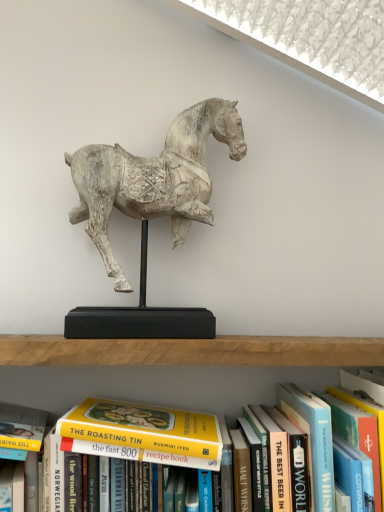
In order to face yellow paperback book at center, should I rotate leftwards or rightwards?

A 6.411 degree turn to the left will do.

Measure the distance between point (178, 144) and camera.

The distance of point (178, 144) from camera is 30.59 inches.

Identify the location of hardcover book at center, acting as the 2th paperback book starting from the right. The width and height of the screenshot is (384, 512). (313, 441).

Looking at this image, in terms of height, does hardcover book at center, which is counted as the first paperback book, starting from the left, look taller or shorter compared to yellow paperback book at center?

hardcover book at center, which is counted as the first paperback book, starting from the left, is taller than yellow paperback book at center.

Does point (334, 510) come behind point (211, 436)?

No.

Is hardcover book at center, which is counted as the first paperback book, starting from the left, next to yellow paperback book at center and touching it?

They are not placed beside each other.

Which of these two, hardcover book at center, which is counted as the first paperback book, starting from the left, or yellow paperback book at center, is thinner?

Thinner between the two is yellow paperback book at center.

From the image's perspective, which one is positioned lower, white wood horse at center or hardcover book at center, acting as the 2th paperback book starting from the right?

hardcover book at center, acting as the 2th paperback book starting from the right, from the image's perspective.

From the picture: Visually, is white wood horse at center positioned to the left or to the right of hardcover book at center, which is counted as the first paperback book, starting from the left?

white wood horse at center is to the left of hardcover book at center, which is counted as the first paperback book, starting from the left.

The height and width of the screenshot is (512, 384). Identify the location of horse that is above the hardcover book at center, which is counted as the first paperback book, starting from the left (from the image's perspective). (154, 178).

Is white wood horse at center bigger than hardcover book at center, which is counted as the first paperback book, starting from the left?

Yes.

Image resolution: width=384 pixels, height=512 pixels. I want to click on book on the left of hardcover book at center, the 1th paperback book viewed from the right, so click(x=142, y=434).

Which is in front, point (375, 455) or point (206, 431)?

Point (375, 455)

Is hardcover book at center, arranged as the 2th paperback book when viewed from the left, positioned beyond the bounds of yellow paperback book at center?

Yes, hardcover book at center, arranged as the 2th paperback book when viewed from the left, is not within yellow paperback book at center.

Is hardcover book at center, the 1th paperback book viewed from the right, touching yellow paperback book at center?

hardcover book at center, the 1th paperback book viewed from the right, and yellow paperback book at center are not in contact.

Is there a large distance between yellow paperback book at center and hardcover book at center, which is counted as the first paperback book, starting from the left?

They are positioned close to each other.

How many degrees apart are the facing directions of yellow paperback book at center and hardcover book at center, acting as the 2th paperback book starting from the right?

0.000523 degrees.

Considering the positions of point (203, 450) and point (292, 384), is point (203, 450) closer or farther from the camera than point (292, 384)?

Point (203, 450).

Where is `book located above the hardcover book at center, which is counted as the first paperback book, starting from the left (from a real-world perspective)`? book located above the hardcover book at center, which is counted as the first paperback book, starting from the left (from a real-world perspective) is located at coordinates (142, 434).

Looking at this image, could you tell me if hardcover book at center, acting as the 2th paperback book starting from the right, is turned towards white wood horse at center?

No.

How many degrees apart are the facing directions of hardcover book at center, acting as the 2th paperback book starting from the right, and white wood horse at center?

hardcover book at center, acting as the 2th paperback book starting from the right, and white wood horse at center are facing 4.95 degrees away from each other.

From a real-world perspective, is hardcover book at center, acting as the 2th paperback book starting from the right, over white wood horse at center?

Actually, hardcover book at center, acting as the 2th paperback book starting from the right, is physically below white wood horse at center in the real world.

Considering the relative sizes of hardcover book at center, acting as the 2th paperback book starting from the right, and white wood horse at center in the image provided, is hardcover book at center, acting as the 2th paperback book starting from the right, wider than white wood horse at center?

Indeed, hardcover book at center, acting as the 2th paperback book starting from the right, has a greater width compared to white wood horse at center.

Is hardcover book at center, arranged as the 2th paperback book when viewed from the left, oriented away from white wood horse at center?

No, hardcover book at center, arranged as the 2th paperback book when viewed from the left, is not facing away from white wood horse at center.

From a real-world perspective, is hardcover book at center, arranged as the 2th paperback book when viewed from the left, below white wood horse at center?

Yes, from a real-world perspective, hardcover book at center, arranged as the 2th paperback book when viewed from the left, is under white wood horse at center.

Between hardcover book at center, arranged as the 2th paperback book when viewed from the left, and white wood horse at center, which one has more height?

Standing taller between the two is white wood horse at center.

Considering the sizes of objects hardcover book at center, arranged as the 2th paperback book when viewed from the left, and white wood horse at center in the image provided, who is thinner, hardcover book at center, arranged as the 2th paperback book when viewed from the left, or white wood horse at center?

white wood horse at center is thinner.

From a real-world perspective, is white wood horse at center below yellow paperback book at center?

No, from a real-world perspective, white wood horse at center is not below yellow paperback book at center.

Considering their positions, is white wood horse at center located in front of or behind yellow paperback book at center?

white wood horse at center is behind yellow paperback book at center.

What's the angular difference between white wood horse at center and yellow paperback book at center's facing directions?

white wood horse at center and yellow paperback book at center are facing 4.95 degrees away from each other.

Is point (173, 142) in front of point (69, 426)?

No, (173, 142) is further to viewer.

Locate an element on the screen. the 1st paperback book located beneath the yellow paperback book at center (from a real-world perspective) is located at coordinates (313, 441).

In the image, there is a hardcover book at center, acting as the 2th paperback book starting from the right. Find the location of `horse above it (from the image's perspective)`. horse above it (from the image's perspective) is located at coordinates (154, 178).

Considering their positions, is white wood horse at center positioned closer to hardcover book at center, which is counted as the first paperback book, starting from the left, than hardcover book at center, the 1th paperback book viewed from the right?

Based on the image, hardcover book at center, the 1th paperback book viewed from the right, appears to be nearer to hardcover book at center, which is counted as the first paperback book, starting from the left.

Consider the image. From the image, which object appears to be nearer to hardcover book at center, acting as the 2th paperback book starting from the right, hardcover book at center, arranged as the 2th paperback book when viewed from the left, or white wood horse at center?

Based on the image, hardcover book at center, arranged as the 2th paperback book when viewed from the left, appears to be nearer to hardcover book at center, acting as the 2th paperback book starting from the right.

When comparing their distances from hardcover book at center, arranged as the 2th paperback book when viewed from the left, does hardcover book at center, which is counted as the first paperback book, starting from the left, or white wood horse at center seem closer?

Among the two, hardcover book at center, which is counted as the first paperback book, starting from the left, is located nearer to hardcover book at center, arranged as the 2th paperback book when viewed from the left.

Based on their spatial positions, is hardcover book at center, acting as the 2th paperback book starting from the right, or yellow paperback book at center further from hardcover book at center, arranged as the 2th paperback book when viewed from the left?

yellow paperback book at center is further to hardcover book at center, arranged as the 2th paperback book when viewed from the left.

Which object lies nearer to the anchor point yellow paperback book at center, white wood horse at center or hardcover book at center, arranged as the 2th paperback book when viewed from the left?

hardcover book at center, arranged as the 2th paperback book when viewed from the left, is closer to yellow paperback book at center.

Looking at this image, looking at the image, which one is located closer to yellow paperback book at center, hardcover book at center, the 1th paperback book viewed from the right, or white wood horse at center?

Among the two, hardcover book at center, the 1th paperback book viewed from the right, is located nearer to yellow paperback book at center.

Which object lies further to the anchor point white wood horse at center, hardcover book at center, the 1th paperback book viewed from the right, or yellow paperback book at center?

Among the two, hardcover book at center, the 1th paperback book viewed from the right, is located further to white wood horse at center.

Looking at the image, which one is located closer to hardcover book at center, the 1th paperback book viewed from the right, yellow paperback book at center or hardcover book at center, which is counted as the first paperback book, starting from the left?

hardcover book at center, which is counted as the first paperback book, starting from the left, is closer to hardcover book at center, the 1th paperback book viewed from the right.

Find the location of a particular element. book between white wood horse at center and hardcover book at center, the 1th paperback book viewed from the right, in the vertical direction is located at coordinates (142, 434).

This screenshot has height=512, width=384. I want to click on book that lies between white wood horse at center and hardcover book at center, acting as the 2th paperback book starting from the right, from top to bottom, so click(x=142, y=434).

Where is `paperback book between yellow paperback book at center and hardcover book at center, arranged as the 2th paperback book when viewed from the left, from left to right`? This screenshot has height=512, width=384. paperback book between yellow paperback book at center and hardcover book at center, arranged as the 2th paperback book when viewed from the left, from left to right is located at coordinates (x=313, y=441).

Locate an element on the screen. Image resolution: width=384 pixels, height=512 pixels. paperback book that lies between white wood horse at center and hardcover book at center, the 1th paperback book viewed from the right, from top to bottom is located at coordinates (313, 441).